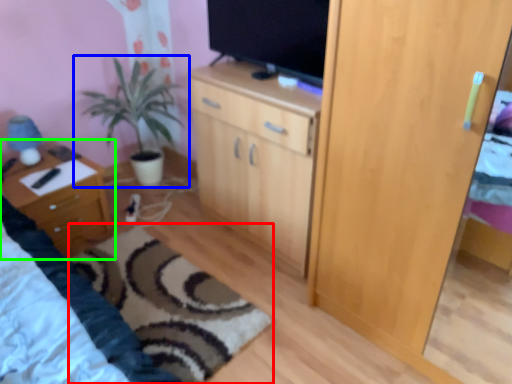
Question: Which object is the closest to the plain (highlighted by a red box)? Choose among these: houseplant (highlighted by a blue box) or nightstand (highlighted by a green box).

Choices:
 (A) houseplant
 (B) nightstand

Answer: (B)